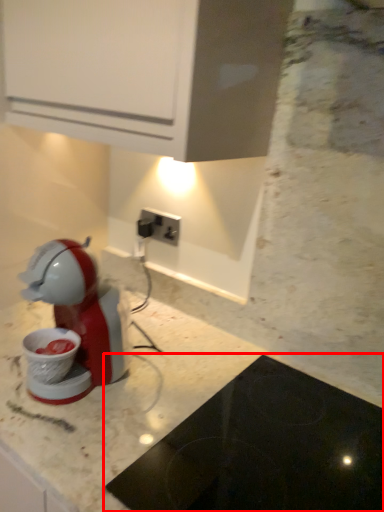
Question: From the image's perspective, considering the relative positions of home appliance (annotated by the red box) and power plugs and sockets in the image provided, where is home appliance (annotated by the red box) located with respect to the staircase?

Choices:
 (A) below
 (B) above

Answer: (A)